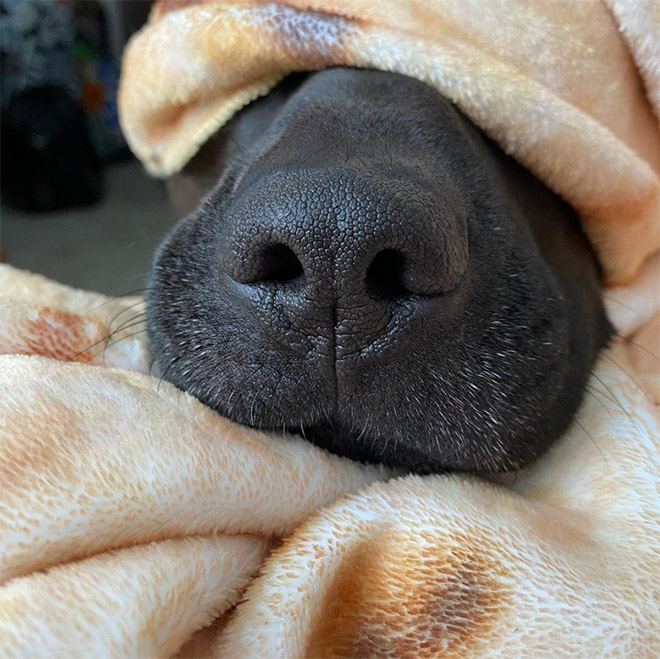
Find the location of a particular element. The height and width of the screenshot is (659, 660). blanket is located at coordinates (447, 515).